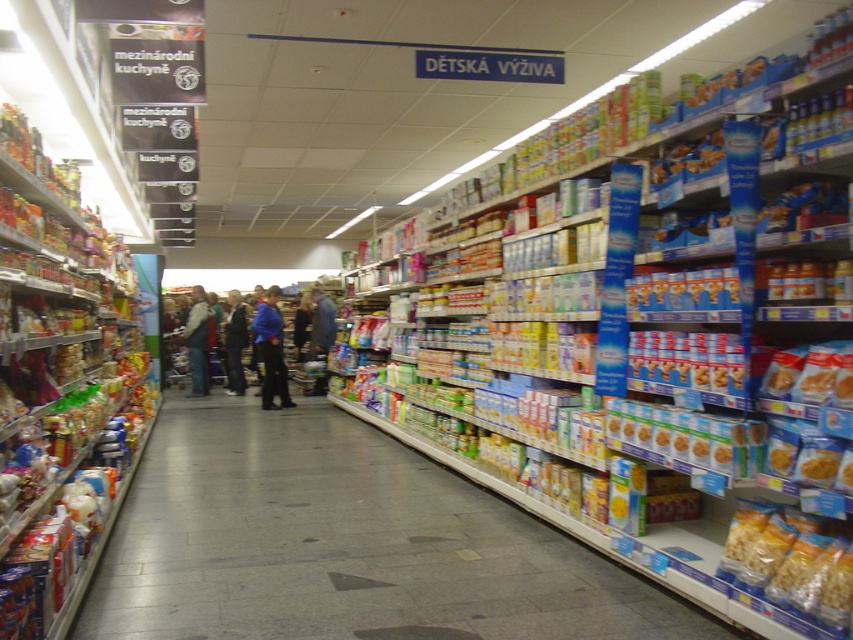
You are a customer in the grocery store aisle looking for a snack that can easily fit into your small bag. You see the translucent brown snack at lower right and the light brown corduroy pants at center. Which item can you fit into your bag more easily?

The translucent brown snack at lower right is thinner than the light brown corduroy pants at center, so it can fit into your bag more easily.

You are a customer in the grocery store aisle looking for the translucent brown snack at lower right. You see the light brown corduroy pants at center blocking your path. Can you walk around them without bending down?

The translucent brown snack at lower right occupies less space than light brown corduroy pants at center, so the snack is smaller. Since the light brown corduroy pants at center are larger, they might be taller or wider, making it difficult to walk around without bending down. However, since the snack is smaller, it might be placed lower, but the pants are at center, so you might need to navigate around them. The answer isn not clear from the given description.

You are standing at the point labeled point at (184, 317) and want to reach the door located 12.52 meters away. What is the shortest path you can take to exit the store?

The shortest path to exit the store would be to move straight towards the door located 12.52 meters away from the point at (184, 317).